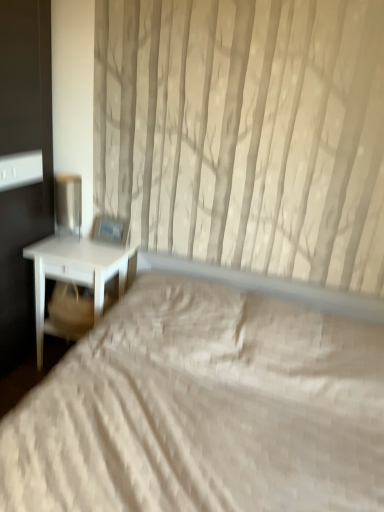
Question: Should I look upward or downward to see beige fabric swivel chair at left?

Choices:
 (A) up
 (B) down

Answer: (B)

Question: Should I look upward or downward to see metallic silver table lamp at left?

Choices:
 (A) down
 (B) up

Answer: (B)

Question: From the image's perspective, is white quilted bed at center under metallic silver table lamp at left?

Choices:
 (A) no
 (B) yes

Answer: (B)

Question: Is white quilted bed at center bigger than metallic silver table lamp at left?

Choices:
 (A) yes
 (B) no

Answer: (A)

Question: Does white quilted bed at center have a smaller size compared to metallic silver table lamp at left?

Choices:
 (A) no
 (B) yes

Answer: (A)

Question: Is white quilted bed at center touching metallic silver table lamp at left?

Choices:
 (A) no
 (B) yes

Answer: (A)

Question: Is white quilted bed at center aimed at metallic silver table lamp at left?

Choices:
 (A) yes
 (B) no

Answer: (B)

Question: Is white quilted bed at center located outside metallic silver table lamp at left?

Choices:
 (A) yes
 (B) no

Answer: (A)

Question: Is beige fabric swivel chair at left thinner than white quilted bed at center?

Choices:
 (A) no
 (B) yes

Answer: (B)

Question: Is beige fabric swivel chair at left positioned with its back to white quilted bed at center?

Choices:
 (A) yes
 (B) no

Answer: (B)

Question: Does beige fabric swivel chair at left have a larger size compared to white quilted bed at center?

Choices:
 (A) no
 (B) yes

Answer: (A)

Question: From a real-world perspective, is beige fabric swivel chair at left on white quilted bed at center?

Choices:
 (A) no
 (B) yes

Answer: (B)

Question: Does beige fabric swivel chair at left turn towards white quilted bed at center?

Choices:
 (A) no
 (B) yes

Answer: (B)

Question: Is white quilted bed at center inside beige fabric swivel chair at left?

Choices:
 (A) no
 (B) yes

Answer: (A)

Question: Does white matte nightstand at left turn towards white quilted bed at center?

Choices:
 (A) yes
 (B) no

Answer: (A)